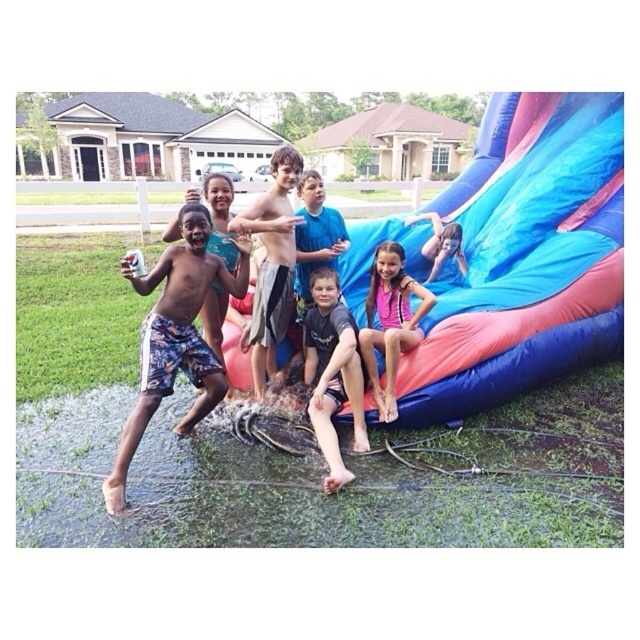
Question: Observing the image, what is the correct spatial positioning of shiny metallic shorts at center in reference to pink fabric at center?

Choices:
 (A) below
 (B) above

Answer: (B)

Question: Estimate the real-world distances between objects in this image. Which object is closer to the printed cotton shorts at left?

Choices:
 (A) dark gray t-shirt at center
 (B) shiny metallic shorts at center

Answer: (B)

Question: Which object is the closest to the printed cotton shorts at left?

Choices:
 (A) shiny metallic shorts at center
 (B) dark gray t-shirt at center

Answer: (A)

Question: Among these points, which one is farthest from the camera?

Choices:
 (A) (435, 278)
 (B) (390, 364)
 (C) (356, 429)
 (D) (211, 397)

Answer: (A)

Question: Does printed cotton shorts at left have a larger size compared to dark gray t-shirt at center?

Choices:
 (A) no
 (B) yes

Answer: (B)

Question: Is shiny metallic shorts at center smaller than blue fabric slide at upper right?

Choices:
 (A) yes
 (B) no

Answer: (B)